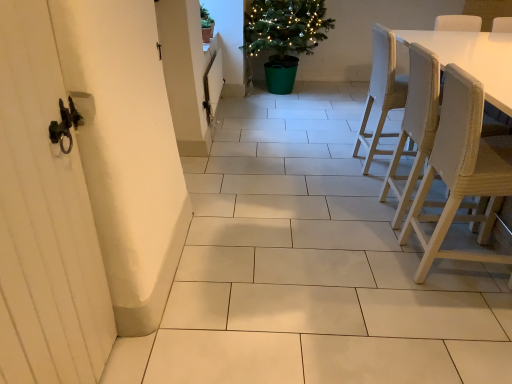
Question: From a real-world perspective, is white wooden screen door at left physically located above or below light beige fabric chair at right, which is counted as the first chair, starting from the back?

Choices:
 (A) below
 (B) above

Answer: (B)

Question: Relative to light beige fabric chair at right, the 3th chair viewed from the front, is white wooden screen door at left in front or behind?

Choices:
 (A) front
 (B) behind

Answer: (A)

Question: Considering the real-world distances, which object is closest to the white wooden screen door at left?

Choices:
 (A) light beige fabric chair at right, the 3th chair viewed from the front
 (B) green matte pot at upper center, the first houseplant from the front
 (C) woven wood chair at right, marked as the 1th chair in a front-to-back arrangement
 (D) green plastic potted plant at upper center, placed as the second houseplant when sorted from left to right
 (E) light brown woven chair at right, which is the second chair from back to front

Answer: (C)

Question: Considering the real-world distances, which object is farthest from the light beige fabric chair at right, which is counted as the first chair, starting from the back?

Choices:
 (A) green plastic potted plant at upper center, which is the 2th houseplant from front to back
 (B) woven wood chair at right, marked as the 1th chair in a front-to-back arrangement
 (C) green matte pot at upper center, which is the 2th houseplant from back to front
 (D) white wooden screen door at left
 (E) light brown woven chair at right, which is counted as the 2th chair, starting from the front

Answer: (D)